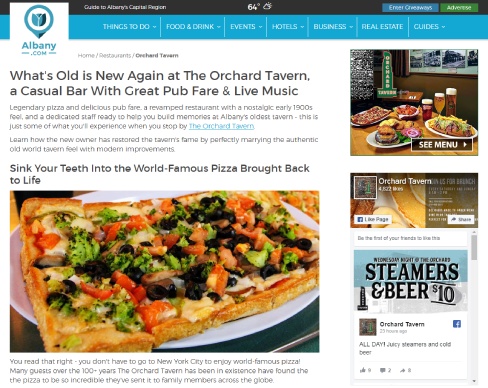
Where is `porcelain dish`? The image size is (488, 388). porcelain dish is located at coordinates point(300,303), point(267,316), point(235,334).